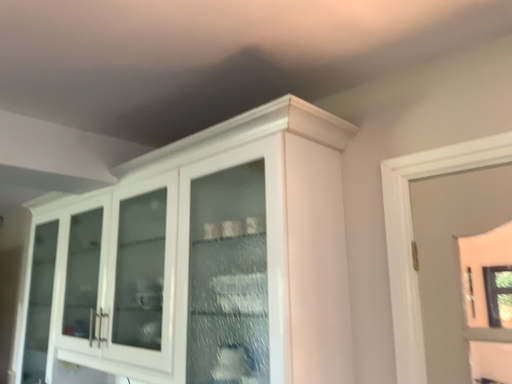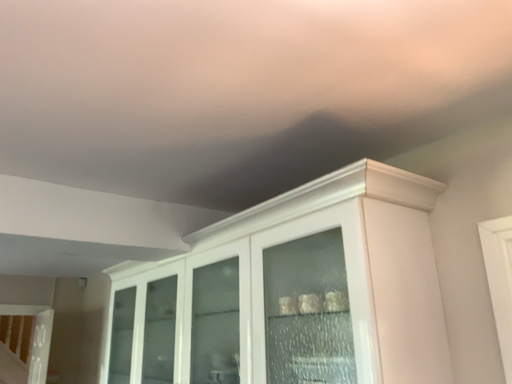
Question: How did the camera likely rotate when shooting the video?

Choices:
 (A) rotated left
 (B) rotated right

Answer: (A)